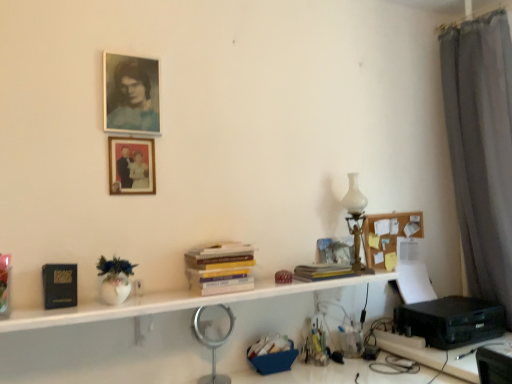
Question: Is silver metallic magnifying glass at center situated inside corkboard at upper right or outside?

Choices:
 (A) inside
 (B) outside

Answer: (B)

Question: Considering the positions of silver metallic magnifying glass at center and corkboard at upper right in the image, is silver metallic magnifying glass at center bigger or smaller than corkboard at upper right?

Choices:
 (A) small
 (B) big

Answer: (B)

Question: Estimate the real-world distances between objects in this image. Which object is closer to the black matte book at left?

Choices:
 (A) yellow paper at center, the first book positioned from the right
 (B) matte paper portrait at upper left, arranged as the 1th picture frame when viewed from the top
 (C) yellow paperbacks at center, positioned as the 1th book in left-to-right order
 (D) white matte shelf at center
 (E) white glass table lamp at right

Answer: (D)

Question: Estimate the real-world distances between objects in this image. Which object is farther from the silver metallic magnifying glass at center?

Choices:
 (A) matte paper portrait at upper left, arranged as the 1th picture frame when viewed from the top
 (B) yellow paperbacks at center, positioned as the 1th book in left-to-right order
 (C) wooden framed photo at upper center, placed as the 1th picture frame when sorted from bottom to top
 (D) yellow paper at center, which is the 2th book from left to right
 (E) black plastic printer at lower right

Answer: (E)